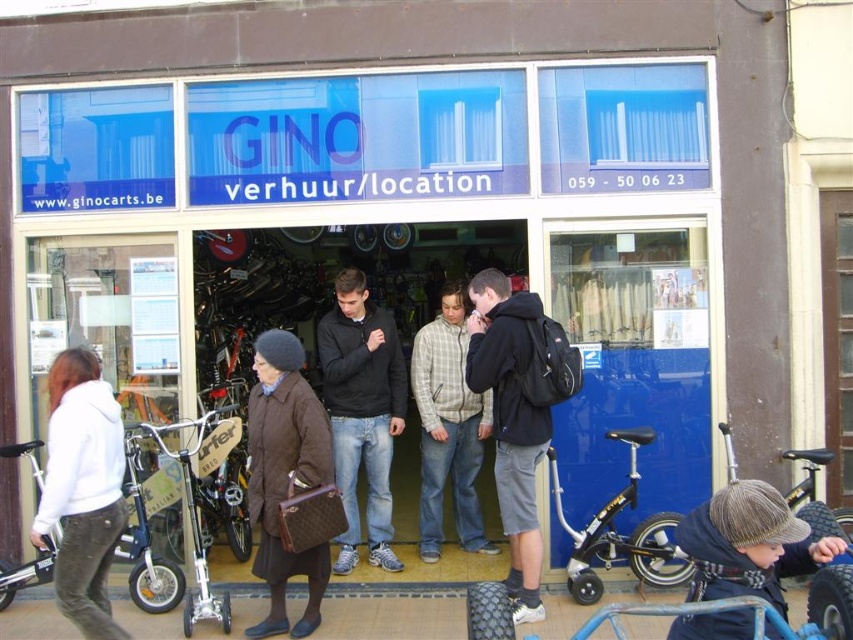
Question: Is black matte jacket at center above light brown plaid shirt at center?

Choices:
 (A) yes
 (B) no

Answer: (A)

Question: Is white fleece jacket at left positioned before light brown plaid shirt at center?

Choices:
 (A) no
 (B) yes

Answer: (B)

Question: Which object is farther from the camera taking this photo?

Choices:
 (A) rubber textured stroller at lower center
 (B) light brown plaid shirt at center
 (C) knitted woolen hat at lower right

Answer: (B)

Question: Which object is farther from the camera taking this photo?

Choices:
 (A) white fleece jacket at left
 (B) black matte jacket at center
 (C) brown quilted coat at center
 (D) dark blue hoodie at center

Answer: (B)

Question: Based on their relative distances, which object is farther from the light brown plaid shirt at center?

Choices:
 (A) blue glass storefront at center
 (B) white fleece jacket at left

Answer: (B)

Question: Can you confirm if brown quilted coat at center is positioned to the right of light brown plaid shirt at center?

Choices:
 (A) yes
 (B) no

Answer: (B)